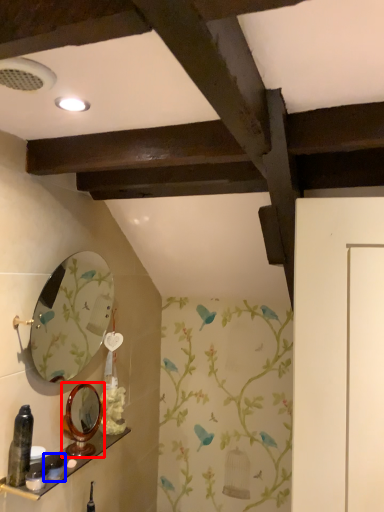
Question: Which point is closer to the camera, mirror (highlighted by a red box) or toiletry (highlighted by a blue box)?

Choices:
 (A) mirror
 (B) toiletry

Answer: (B)